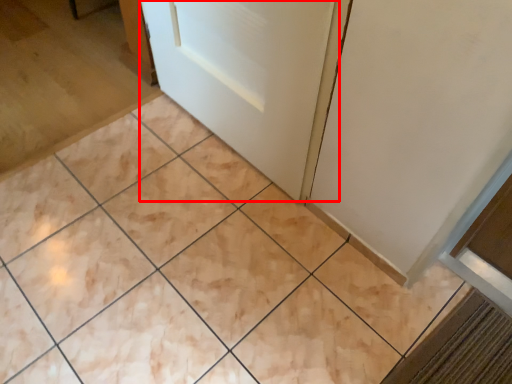
Question: Observing the image, what is the correct spatial positioning of door (annotated by the red box) in reference to ceramic tile?

Choices:
 (A) right
 (B) left

Answer: (B)